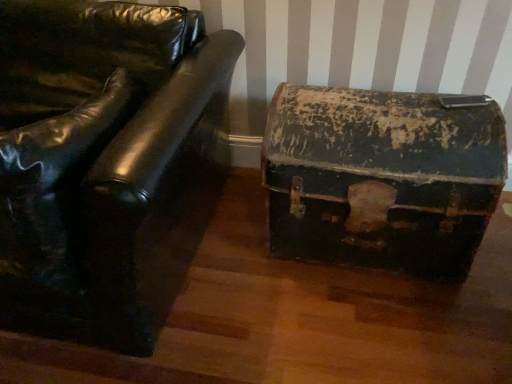
Question: Can we say rusty metal trunk at right lies outside matte black leather couch at left?

Choices:
 (A) yes
 (B) no

Answer: (A)

Question: Is rusty metal trunk at right shorter than matte black leather couch at left?

Choices:
 (A) yes
 (B) no

Answer: (A)

Question: Is rusty metal trunk at right looking in the opposite direction of matte black leather couch at left?

Choices:
 (A) yes
 (B) no

Answer: (B)

Question: From the image's perspective, is rusty metal trunk at right under matte black leather couch at left?

Choices:
 (A) no
 (B) yes

Answer: (B)

Question: From a real-world perspective, is rusty metal trunk at right beneath matte black leather couch at left?

Choices:
 (A) no
 (B) yes

Answer: (B)

Question: Is rusty metal trunk at right to the right of matte black leather couch at left from the viewer's perspective?

Choices:
 (A) yes
 (B) no

Answer: (A)

Question: Considering the relative sizes of matte black leather couch at left and rusty metal trunk at right in the image provided, is matte black leather couch at left bigger than rusty metal trunk at right?

Choices:
 (A) no
 (B) yes

Answer: (B)

Question: Considering the relative sizes of matte black leather couch at left and rusty metal trunk at right in the image provided, is matte black leather couch at left smaller than rusty metal trunk at right?

Choices:
 (A) yes
 (B) no

Answer: (B)

Question: Is matte black leather couch at left with rusty metal trunk at right?

Choices:
 (A) no
 (B) yes

Answer: (A)

Question: Considering the relative positions of matte black leather couch at left and rusty metal trunk at right in the image provided, is matte black leather couch at left to the left of rusty metal trunk at right from the viewer's perspective?

Choices:
 (A) yes
 (B) no

Answer: (A)

Question: Are matte black leather couch at left and rusty metal trunk at right located far from each other?

Choices:
 (A) yes
 (B) no

Answer: (B)

Question: Is matte black leather couch at left further to the viewer compared to rusty metal trunk at right?

Choices:
 (A) yes
 (B) no

Answer: (B)

Question: Based on their sizes in the image, would you say rusty metal trunk at right is bigger or smaller than matte black leather couch at left?

Choices:
 (A) big
 (B) small

Answer: (B)